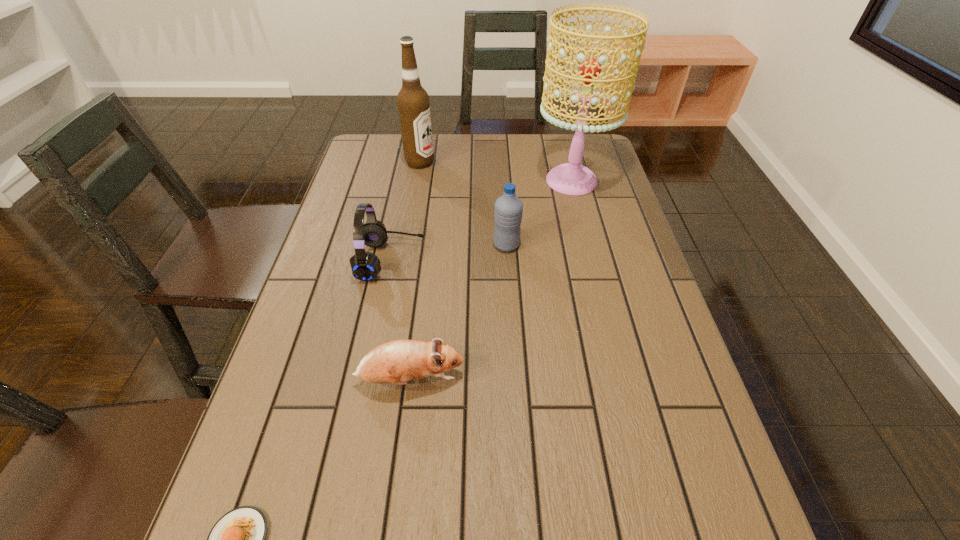
Find the location of a particular element. The image size is (960, 540). the rightmost object is located at coordinates (571, 178).

Locate an element on the screen. This screenshot has height=540, width=960. the tallest object is located at coordinates (571, 178).

Where is `alcohol`? This screenshot has height=540, width=960. alcohol is located at coordinates (413, 103).

Find the location of `the second object from right to left`. the second object from right to left is located at coordinates (508, 210).

Where is `headset`? Image resolution: width=960 pixels, height=540 pixels. headset is located at coordinates tap(365, 266).

Find the location of `hamster`. hamster is located at coordinates (397, 362).

Locate an element on the screen. Image resolution: width=960 pixels, height=540 pixels. the fifth farthest object is located at coordinates (397, 362).

Where is `free space located on the left of the rightmost object`? free space located on the left of the rightmost object is located at coordinates (495, 181).

Locate an element on the screen. The width and height of the screenshot is (960, 540). vacant space located on the label of the second tallest object is located at coordinates (470, 163).

Locate an element on the screen. The height and width of the screenshot is (540, 960). vacant area located 0.140m on the right of the second object from right to left is located at coordinates (572, 245).